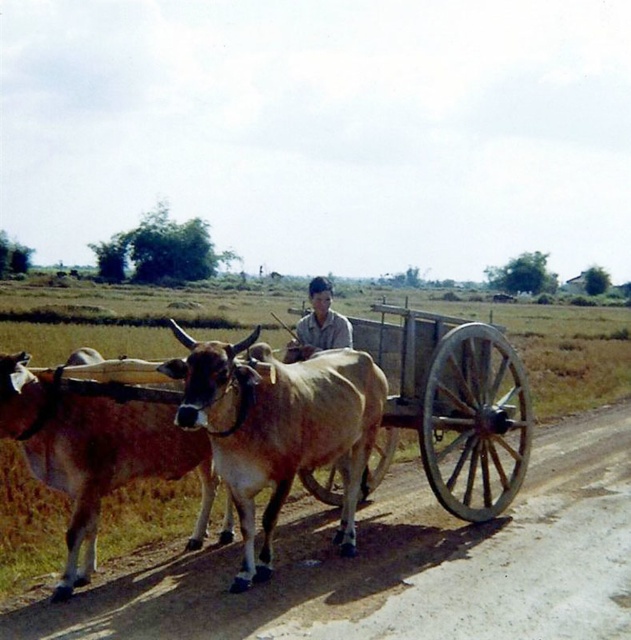
Measure the distance from brown dirt track at lower center to wooden cart at center.

34.74 inches

Between brown dirt track at lower center and wooden cart at center, which one appears on the left side from the viewer's perspective?

brown dirt track at lower center

Does point (560, 621) lie in front of point (469, 480)?

Yes, it is.

What are the coordinates of `brown dirt track at lower center` in the screenshot? It's located at (403, 566).

Describe the element at coordinates (278, 426) in the screenshot. I see `brown glossy bull at center` at that location.

Is point (245, 547) positioned after point (423, 467)?

No, it is not.

This screenshot has width=631, height=640. What are the coordinates of `brown glossy bull at center` in the screenshot? It's located at pos(278,426).

Which is more to the left, brown glossy bull at center or brown glossy bull at left?

brown glossy bull at left

Can you confirm if brown glossy bull at center is positioned to the left of brown glossy bull at left?

No, brown glossy bull at center is not to the left of brown glossy bull at left.

Who is more forward, (233, 368) or (80, 582)?

Positioned in front is point (233, 368).

Find the location of a particular element. The height and width of the screenshot is (640, 631). brown glossy bull at center is located at coordinates (278, 426).